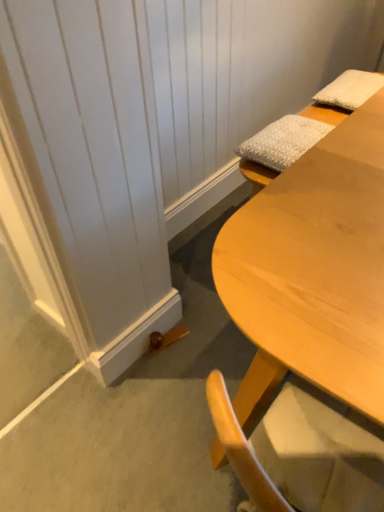
Question: Does white textured pillow at upper right, positioned as the first pillow in right-to-left order, turn towards light wood desk at lower right?

Choices:
 (A) yes
 (B) no

Answer: (B)

Question: Is white textured pillow at upper right, positioned as the 2th pillow in front-to-back order, positioned beyond the bounds of light wood desk at lower right?

Choices:
 (A) yes
 (B) no

Answer: (A)

Question: Is light wood desk at lower right completely or partially inside white textured pillow at upper right, arranged as the second pillow when ordered from the bottom?

Choices:
 (A) no
 (B) yes

Answer: (A)

Question: Does white textured pillow at upper right, positioned as the first pillow in right-to-left order, touch light wood desk at lower right?

Choices:
 (A) no
 (B) yes

Answer: (A)

Question: Is white textured pillow at upper right, positioned as the first pillow in right-to-left order, far away from light wood desk at lower right?

Choices:
 (A) yes
 (B) no

Answer: (B)

Question: Is white textured pillow at upper right, the second pillow in the left-to-right sequence, further to the viewer compared to light wood desk at lower right?

Choices:
 (A) yes
 (B) no

Answer: (A)

Question: Is light wood desk at lower right positioned far away from white textured pillow at upper right, the 1th pillow when ordered from bottom to top?

Choices:
 (A) yes
 (B) no

Answer: (B)

Question: Does light wood desk at lower right appear on the right side of white textured pillow at upper right, the 1th pillow when ordered from bottom to top?

Choices:
 (A) yes
 (B) no

Answer: (B)

Question: Considering the relative positions of light wood desk at lower right and white textured pillow at upper right, the first pillow positioned from the left, in the image provided, is light wood desk at lower right behind white textured pillow at upper right, the first pillow positioned from the left,?

Choices:
 (A) no
 (B) yes

Answer: (A)

Question: Does light wood desk at lower right have a lesser width compared to white textured pillow at upper right, the second pillow when ordered from back to front?

Choices:
 (A) no
 (B) yes

Answer: (A)

Question: Is light wood desk at lower right turned away from white textured pillow at upper right, the 1th pillow when ordered from bottom to top?

Choices:
 (A) yes
 (B) no

Answer: (B)

Question: From the image's perspective, is light wood desk at lower right located beneath white textured pillow at upper right, which is the 2th pillow from right to left?

Choices:
 (A) yes
 (B) no

Answer: (A)

Question: From a real-world perspective, is white textured pillow at upper right, the 1th pillow when ordered from bottom to top, located beneath white textured pillow at upper right, positioned as the first pillow in right-to-left order?

Choices:
 (A) yes
 (B) no

Answer: (A)